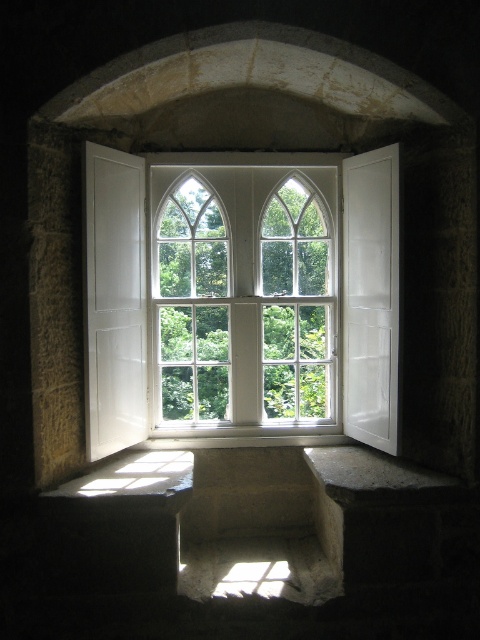
You are an interior designer planning to place a 1.2 meter wide sofa in the living room. The sofa must be positioned so that it faces the window. Given that the white wooden bay window at center and the white glass window at center are both potential focal points, which window should the sofa face to ensure it fits within the available space?

The white wooden bay window at center is wider than the white glass window at center, so the sofa should face the white wooden bay window at center to ensure it fits within the available space.

You are an interior designer planning to install a new curtain rod for the white wooden bay window at center and the white glass window at center. Which window requires a taller curtain rod?

The white wooden bay window at center requires a taller curtain rod because it is much taller than the white glass window at center.

You are standing in a room with a large window. You notice two parts of the window structure. One is the white wooden bay window at center, and the other is the white glass window at center. Which one is positioned to the left of the other?

The white wooden bay window at center is to the left of the white glass window at center.